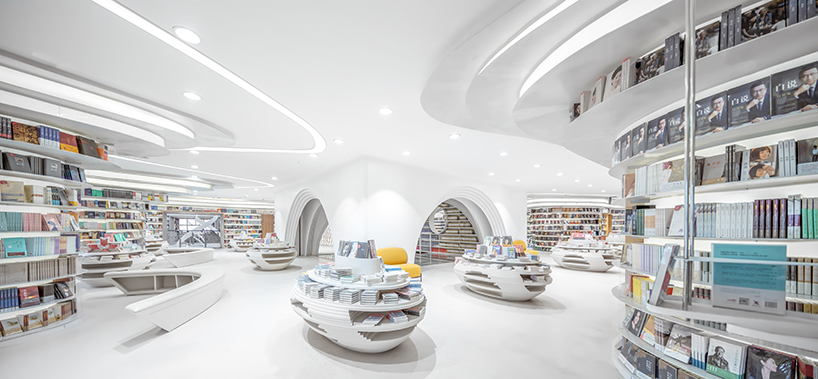
This screenshot has width=818, height=379. I want to click on floor, so click(x=482, y=344).